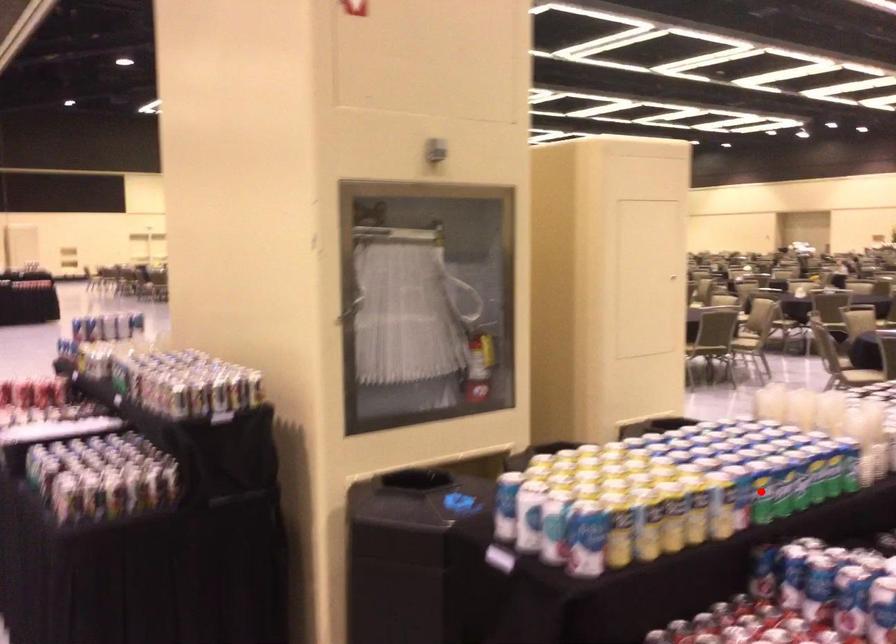
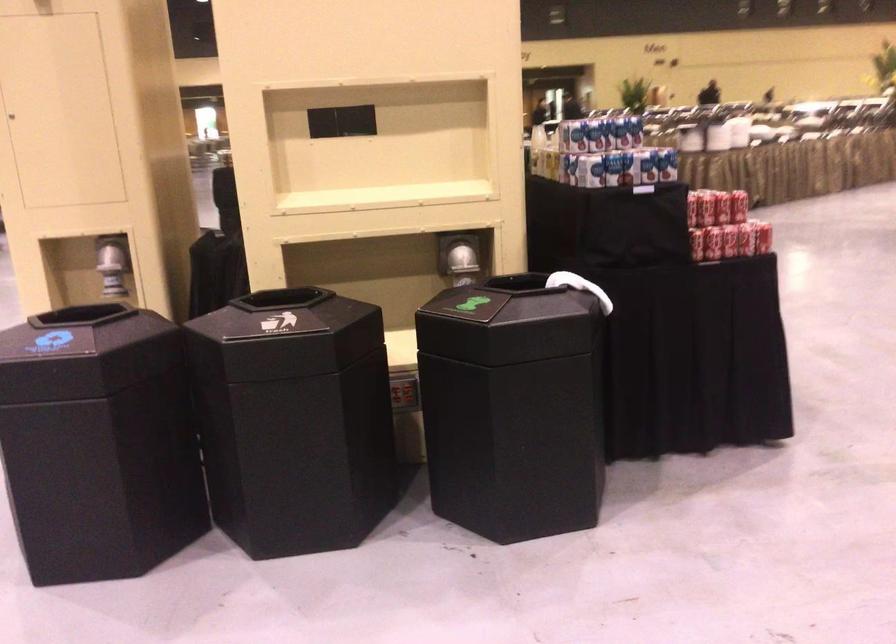
Question: I am providing you with two images of the same scene from different viewpoints. A red point is marked on the first image. At the location where the point appears in image 1, is it still visible in image 2?

Choices:
 (A) Yes
 (B) No

Answer: (B)